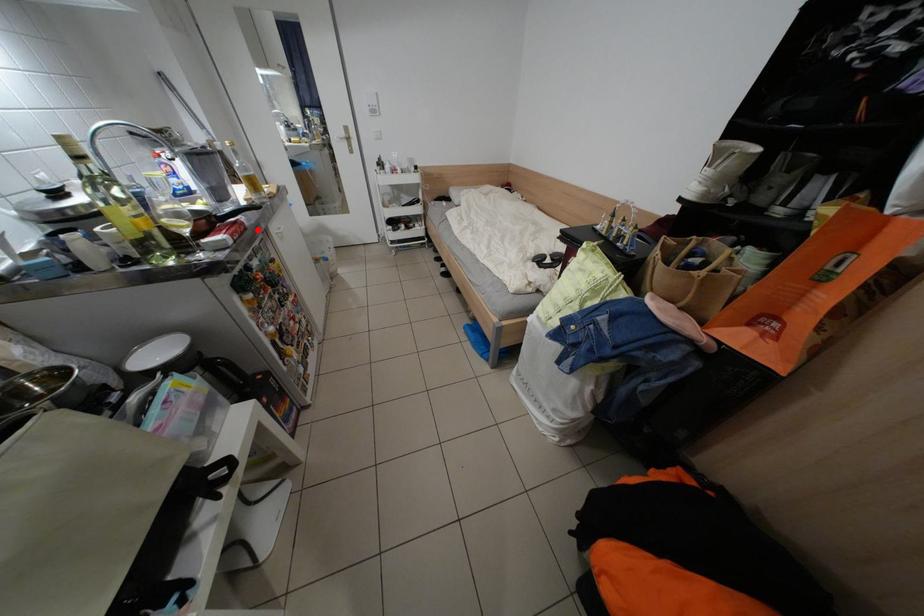
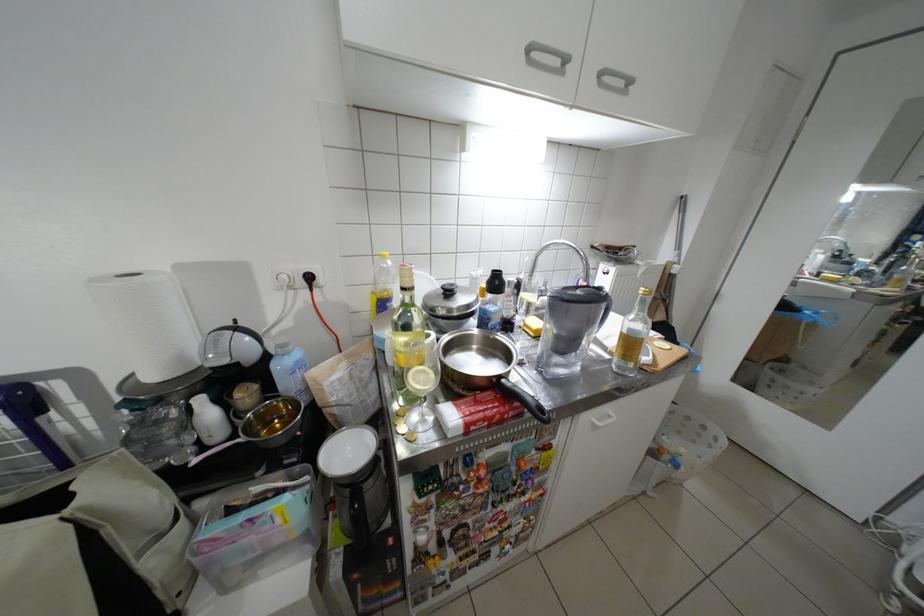
Locate, in the second image, the point that corresponds to the highlighted location in the first image.

(532, 415)